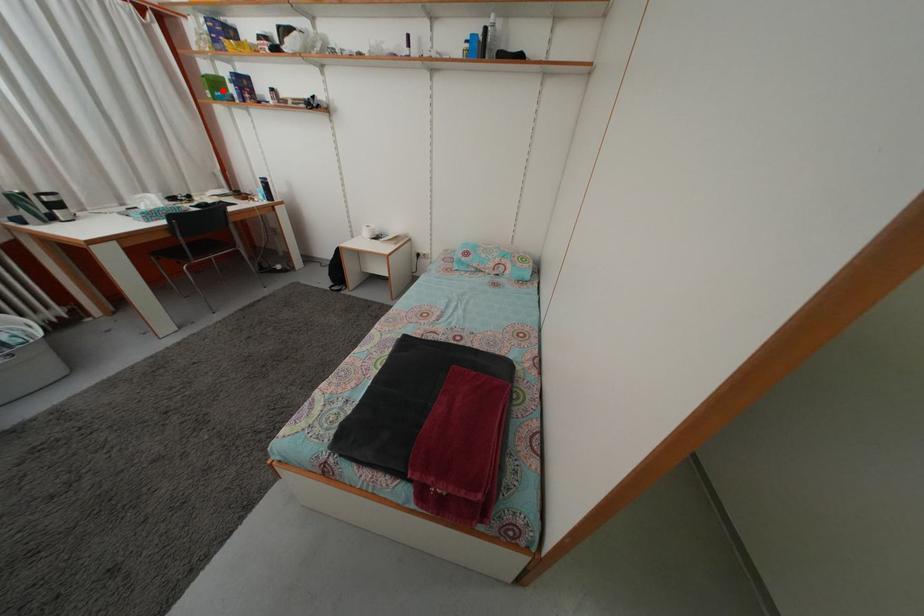
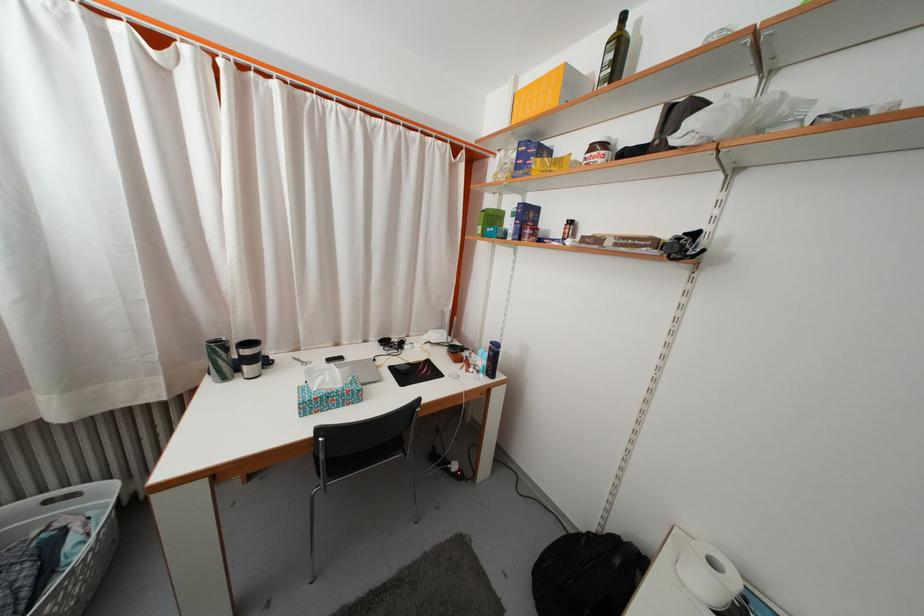
Locate, in the second image, the point that corresponds to the highlighted location in the first image.

(500, 225)